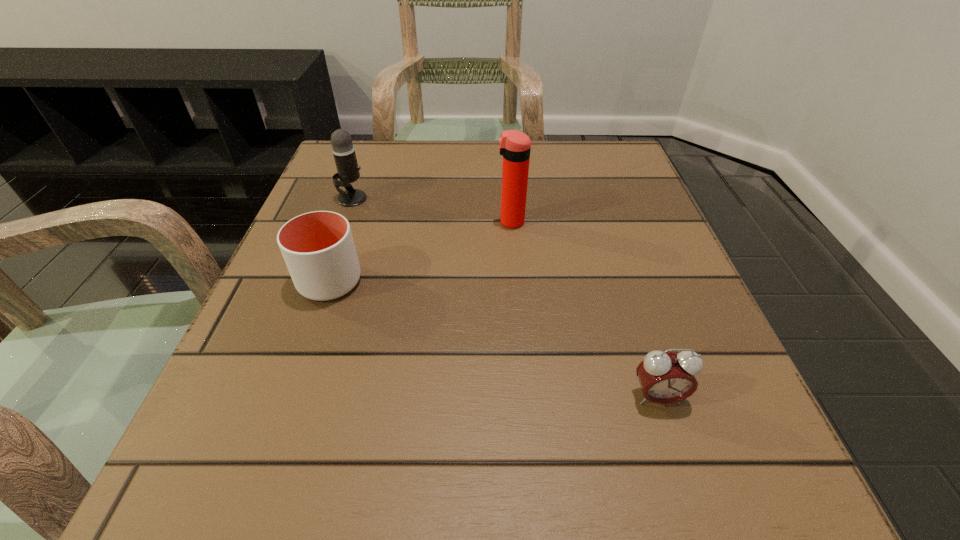
In the image, there is a desktop. Identify the location of free region at the far left corner. The image size is (960, 540). (324, 172).

Where is `vacant point at the near left corner`? This screenshot has height=540, width=960. vacant point at the near left corner is located at coordinates (225, 447).

Identify the location of vacant space at the far right corner of the desktop. (571, 191).

Identify the location of vacant area at the near right corner of the desktop. This screenshot has width=960, height=540. (673, 457).

You are a GUI agent. You are given a task and a screenshot of the screen. Output one action in this format:
    pyautogui.click(x=<x>, y=<y>)
    Task: Click on the vacant region between the third shortest object and the nearest object
    
    Given the screenshot: What is the action you would take?
    pyautogui.click(x=505, y=298)

The image size is (960, 540). Find the location of `empty space between the tallest object and the second nearest object`. empty space between the tallest object and the second nearest object is located at coordinates (420, 252).

At what (x,y) coordinates should I click in order to perform the action: click on free area in between the cup and the tallest object. Please return your answer as a coordinate pair (x, y). Image resolution: width=960 pixels, height=540 pixels. Looking at the image, I should click on (420, 252).

This screenshot has height=540, width=960. In order to click on free spot between the rightmost object and the cup in this screenshot , I will do `click(493, 339)`.

At what (x,y) coordinates should I click in order to perform the action: click on free space between the third farthest object and the rightmost object. Please return your answer as a coordinate pair (x, y). The image size is (960, 540). Looking at the image, I should click on (493, 339).

Locate an element on the screen. This screenshot has width=960, height=540. free space between the second tallest object and the nearest object is located at coordinates pyautogui.click(x=505, y=298).